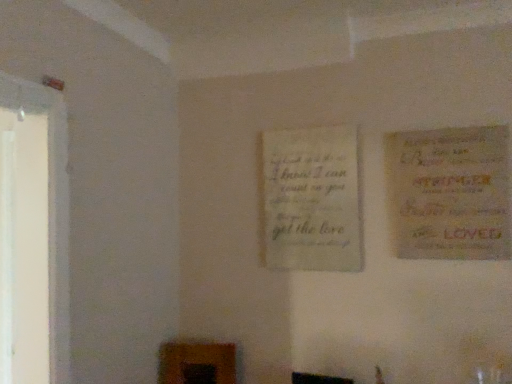
Measure the distance between point (356,205) and camera.

5.90 feet.

What do you see at coordinates (311, 199) in the screenshot? The image size is (512, 384). I see `light beige paper at center, marked as the first poster in a back-to-front arrangement` at bounding box center [311, 199].

At what (x,y) coordinates should I click in order to perform the action: click on light beige paper at center, which is counted as the second poster, starting from the front. Please return your answer as a coordinate pair (x, y). The width and height of the screenshot is (512, 384). Looking at the image, I should click on (311, 199).

Describe the element at coordinates (450, 193) in the screenshot. This screenshot has height=384, width=512. I see `yellow paper poster at right, which ranks as the second poster in back-to-front order` at that location.

Find the location of a particular element. The image size is (512, 384). yellow paper poster at right, which ranks as the second poster in back-to-front order is located at coordinates (450, 193).

I want to click on light beige paper at center, marked as the first poster in a back-to-front arrangement, so click(311, 199).

In the image, is yellow paper poster at right, which ranks as the second poster in back-to-front order, on the left side or the right side of light beige paper at center, the first poster from the left?

In the image, yellow paper poster at right, which ranks as the second poster in back-to-front order, appears on the right side of light beige paper at center, the first poster from the left.

Considering the positions of objects yellow paper poster at right, acting as the first poster starting from the front, and light beige paper at center, marked as the first poster in a back-to-front arrangement, in the image provided, who is behind, yellow paper poster at right, acting as the first poster starting from the front, or light beige paper at center, marked as the first poster in a back-to-front arrangement,?

light beige paper at center, marked as the first poster in a back-to-front arrangement.

Between point (401, 208) and point (288, 246), which one is positioned behind?

The point (288, 246) is farther.

From the image's perspective, does yellow paper poster at right, acting as the first poster starting from the front, appear higher than light beige paper at center, which is counted as the second poster, starting from the front?

Correct, yellow paper poster at right, acting as the first poster starting from the front, appears higher than light beige paper at center, which is counted as the second poster, starting from the front, in the image.

From a real-world perspective, between yellow paper poster at right, acting as the first poster starting from the front, and light beige paper at center, the 2th poster in the right-to-left sequence, who is vertically higher?

yellow paper poster at right, acting as the first poster starting from the front, is physically above.

Considering the sizes of objects yellow paper poster at right, which ranks as the second poster in back-to-front order, and light beige paper at center, which is counted as the second poster, starting from the front, in the image provided, who is thinner, yellow paper poster at right, which ranks as the second poster in back-to-front order, or light beige paper at center, which is counted as the second poster, starting from the front,?

light beige paper at center, which is counted as the second poster, starting from the front, is thinner.

In terms of height, does yellow paper poster at right, acting as the first poster starting from the front, look taller or shorter compared to light beige paper at center, which is counted as the second poster, starting from the front?

In the image, yellow paper poster at right, acting as the first poster starting from the front, appears to be shorter than light beige paper at center, which is counted as the second poster, starting from the front.

Does yellow paper poster at right, marked as the 2th poster in a left-to-right arrangement, have a smaller size compared to light beige paper at center, which is counted as the second poster, starting from the front?

No.

Could light beige paper at center, the first poster from the left, be considered to be inside yellow paper poster at right, marked as the 2th poster in a left-to-right arrangement?

Actually, light beige paper at center, the first poster from the left, is outside yellow paper poster at right, marked as the 2th poster in a left-to-right arrangement.

Is yellow paper poster at right, acting as the first poster starting from the front, looking in the opposite direction of light beige paper at center, marked as the first poster in a back-to-front arrangement?

No, yellow paper poster at right, acting as the first poster starting from the front, is not facing away from light beige paper at center, marked as the first poster in a back-to-front arrangement.

Can you tell me how much yellow paper poster at right, which ranks as the second poster in back-to-front order, and light beige paper at center, which is counted as the second poster, starting from the front, differ in facing direction?

The angular difference between yellow paper poster at right, which ranks as the second poster in back-to-front order, and light beige paper at center, which is counted as the second poster, starting from the front, is 0.372 degrees.

Measure the distance between yellow paper poster at right, which appears as the 1th poster when viewed from the right, and light beige paper at center, the first poster from the left.

A distance of 13.45 inches exists between yellow paper poster at right, which appears as the 1th poster when viewed from the right, and light beige paper at center, the first poster from the left.

Find the location of a particular element. Image resolution: width=512 pixels, height=384 pixels. poster behind the yellow paper poster at right, which appears as the 1th poster when viewed from the right is located at coordinates (311, 199).

Visually, is light beige paper at center, the 2th poster in the right-to-left sequence, positioned to the left or to the right of yellow paper poster at right, which appears as the 1th poster when viewed from the right?

From the image, it's evident that light beige paper at center, the 2th poster in the right-to-left sequence, is to the left of yellow paper poster at right, which appears as the 1th poster when viewed from the right.

Between light beige paper at center, the 2th poster in the right-to-left sequence, and yellow paper poster at right, which ranks as the second poster in back-to-front order, which one is positioned in front?

yellow paper poster at right, which ranks as the second poster in back-to-front order, is more forward.

Is point (273, 135) positioned behind point (448, 189)?

Yes, point (273, 135) is behind point (448, 189).

From the image's perspective, is light beige paper at center, the first poster from the left, on yellow paper poster at right, acting as the first poster starting from the front?

Actually, light beige paper at center, the first poster from the left, appears below yellow paper poster at right, acting as the first poster starting from the front, in the image.

From a real-world perspective, does light beige paper at center, which is counted as the second poster, starting from the front, sit lower than yellow paper poster at right, which ranks as the second poster in back-to-front order?

Yes, from a real-world perspective, light beige paper at center, which is counted as the second poster, starting from the front, is beneath yellow paper poster at right, which ranks as the second poster in back-to-front order.

Does light beige paper at center, which is counted as the second poster, starting from the front, have a lesser width compared to yellow paper poster at right, marked as the 2th poster in a left-to-right arrangement?

Yes.

Does light beige paper at center, which is counted as the second poster, starting from the front, have a greater height compared to yellow paper poster at right, acting as the first poster starting from the front?

Yes, light beige paper at center, which is counted as the second poster, starting from the front, is taller than yellow paper poster at right, acting as the first poster starting from the front.

Considering the sizes of objects light beige paper at center, which is counted as the second poster, starting from the front, and yellow paper poster at right, which ranks as the second poster in back-to-front order, in the image provided, who is bigger, light beige paper at center, which is counted as the second poster, starting from the front, or yellow paper poster at right, which ranks as the second poster in back-to-front order,?

yellow paper poster at right, which ranks as the second poster in back-to-front order, is bigger.

Can we say light beige paper at center, the 2th poster in the right-to-left sequence, lies outside yellow paper poster at right, acting as the first poster starting from the front?

Indeed, light beige paper at center, the 2th poster in the right-to-left sequence, is completely outside yellow paper poster at right, acting as the first poster starting from the front.

Are light beige paper at center, which is counted as the second poster, starting from the front, and yellow paper poster at right, which appears as the 1th poster when viewed from the right, located far from each other?

light beige paper at center, which is counted as the second poster, starting from the front, is near yellow paper poster at right, which appears as the 1th poster when viewed from the right, not far away.

Does light beige paper at center, the first poster from the left, turn towards yellow paper poster at right, marked as the 2th poster in a left-to-right arrangement?

No, light beige paper at center, the first poster from the left, does not turn towards yellow paper poster at right, marked as the 2th poster in a left-to-right arrangement.

Measure the distance from light beige paper at center, the 2th poster in the right-to-left sequence, to yellow paper poster at right, which ranks as the second poster in back-to-front order.

light beige paper at center, the 2th poster in the right-to-left sequence, is 13.45 inches away from yellow paper poster at right, which ranks as the second poster in back-to-front order.

The height and width of the screenshot is (384, 512). I want to click on poster behind the yellow paper poster at right, marked as the 2th poster in a left-to-right arrangement, so click(311, 199).

Identify the location of poster lying below the yellow paper poster at right, which ranks as the second poster in back-to-front order (from the image's perspective). (311, 199).

At what (x,y) coordinates should I click in order to perform the action: click on poster that is in front of the light beige paper at center, which is counted as the second poster, starting from the front. Please return your answer as a coordinate pair (x, y). This screenshot has width=512, height=384. Looking at the image, I should click on (450, 193).